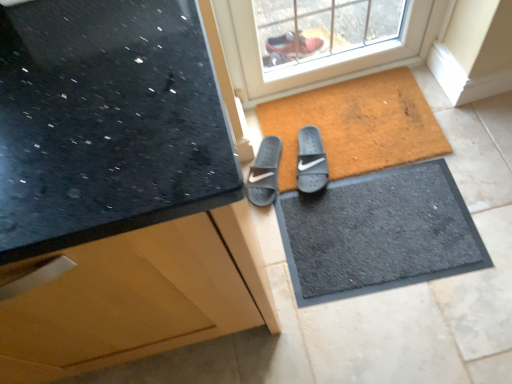
I want to click on vacant space underneath gray rubber slide at center, which is the 1th footwear in left-to-right order (from a real-world perspective), so click(258, 171).